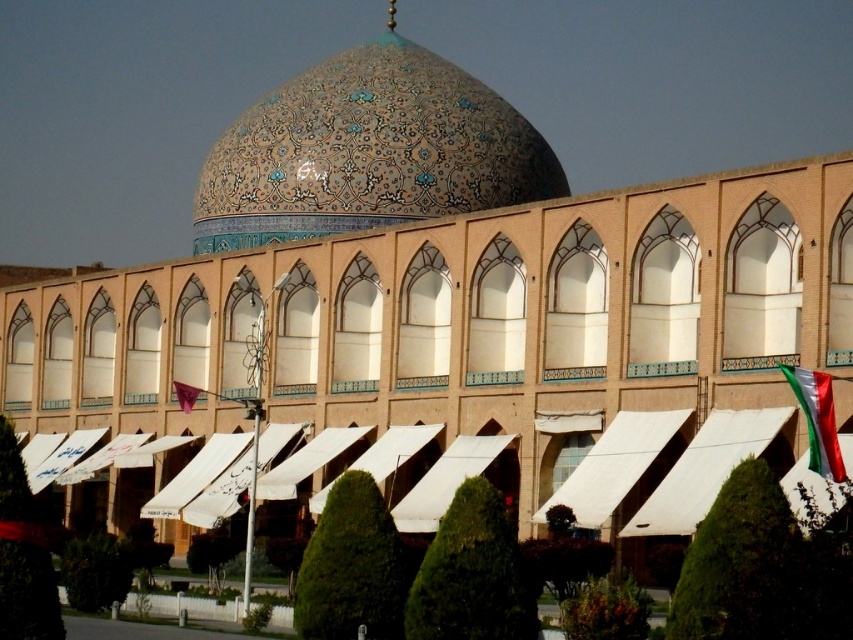
Question: Can you confirm if glazed ceramic dome at center is bigger than green and white fabric flag at lower right?

Choices:
 (A) yes
 (B) no

Answer: (A)

Question: Does glazed ceramic dome at center appear on the right side of green and white fabric flag at lower right?

Choices:
 (A) no
 (B) yes

Answer: (A)

Question: Which point is closer to the camera?

Choices:
 (A) green and white fabric flag at lower right
 (B) glazed ceramic dome at center

Answer: (A)

Question: Which of the following is the farthest from the observer?

Choices:
 (A) glazed ceramic dome at center
 (B) green and white fabric flag at lower right

Answer: (A)

Question: Which point is farther to the camera?

Choices:
 (A) glazed ceramic dome at center
 (B) green and white fabric flag at lower right

Answer: (A)

Question: Is glazed ceramic dome at center bigger than green and white fabric flag at lower right?

Choices:
 (A) no
 (B) yes

Answer: (B)